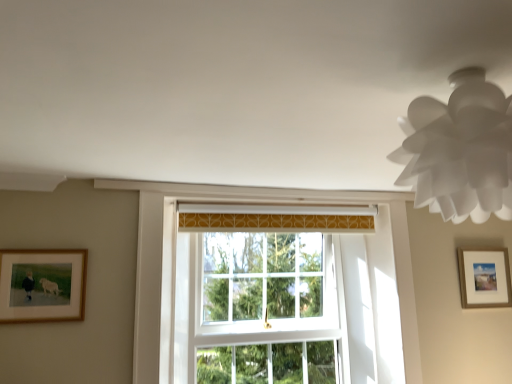
Question: Would you say wooden framed picture at right, positioned as the 2th picture frame in front-to-back order, is to the left or to the right of white paper lampshade at upper right in the picture?

Choices:
 (A) left
 (B) right

Answer: (B)

Question: Is wooden framed picture at right, the 1th picture frame positioned from the right, wider or thinner than white paper lampshade at upper right?

Choices:
 (A) thin
 (B) wide

Answer: (A)

Question: Which object is the closest to the wooden framed picture at right, the 1th picture frame positioned from the right?

Choices:
 (A) white glass window at center
 (B) wooden framed picture at left, acting as the second picture frame starting from the back
 (C) white paper lampshade at upper right

Answer: (A)

Question: Estimate the real-world distances between objects in this image. Which object is closer to the white paper lampshade at upper right?

Choices:
 (A) wooden framed picture at right, the second picture frame viewed from the left
 (B) white glass window at center
 (C) wooden framed picture at left, acting as the second picture frame starting from the back

Answer: (C)